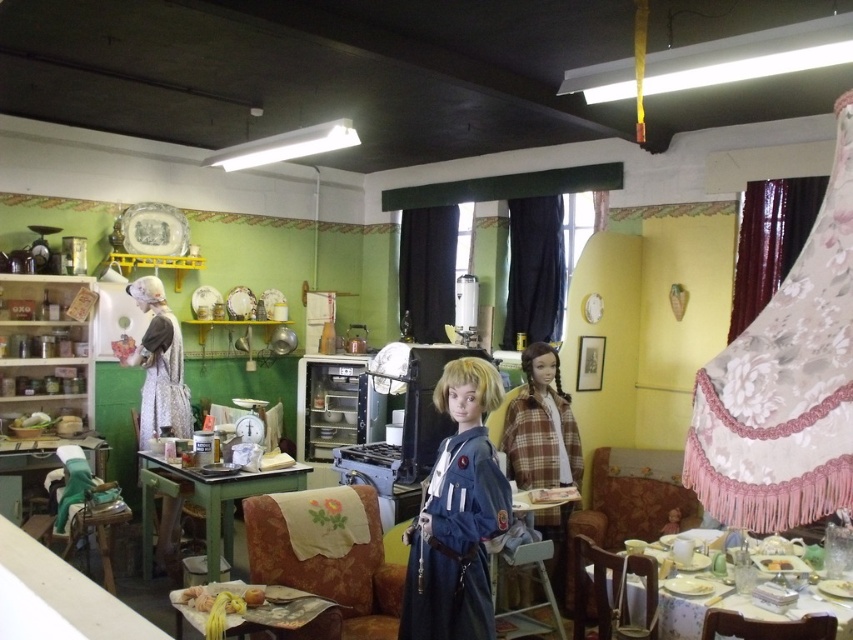
What do you see at coordinates (210, 500) in the screenshot? I see `green painted wood table at lower left` at bounding box center [210, 500].

Does green painted wood table at lower left have a lesser width compared to patterned fabric table at lower right?

No, green painted wood table at lower left is not thinner than patterned fabric table at lower right.

Where is `green painted wood table at lower left`? This screenshot has width=853, height=640. green painted wood table at lower left is located at coordinates click(210, 500).

Does blue fabric doll at center appear under patterned fabric table at lower right?

Actually, blue fabric doll at center is above patterned fabric table at lower right.

Is blue fabric doll at center to the left of patterned fabric table at lower right from the viewer's perspective?

Yes, blue fabric doll at center is to the left of patterned fabric table at lower right.

Who is more distant from viewer, (509, 504) or (642, 596)?

Point (642, 596)

In order to click on blue fabric doll at center in this screenshot , I will do `click(457, 515)`.

Is green painted wood table at lower left in front of yellow matte apple at lower center?

No, it is not.

Who is positioned more to the left, green painted wood table at lower left or yellow matte apple at lower center?

green painted wood table at lower left is more to the left.

The width and height of the screenshot is (853, 640). Identify the location of green painted wood table at lower left. (210, 500).

The image size is (853, 640). Find the location of `green painted wood table at lower left`. green painted wood table at lower left is located at coordinates tap(210, 500).